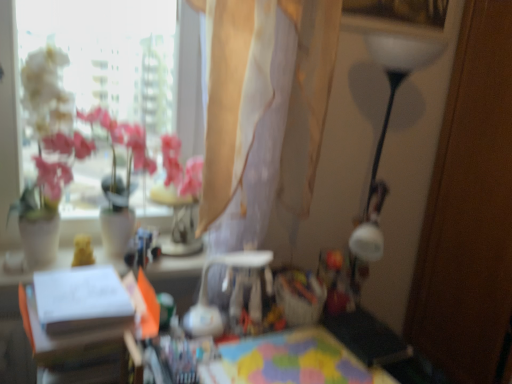
Question: Is white paper at center, the first table viewed from the left, a part of translucent beige curtain at upper center?

Choices:
 (A) yes
 (B) no

Answer: (B)

Question: Does translucent beige curtain at upper center have a smaller size compared to white paper at center, the first table viewed from the left?

Choices:
 (A) yes
 (B) no

Answer: (B)

Question: Does translucent beige curtain at upper center appear on the right side of white paper at center, which is the second table in right-to-left order?

Choices:
 (A) no
 (B) yes

Answer: (B)

Question: Is translucent beige curtain at upper center outside of white paper at center, the first table viewed from the left?

Choices:
 (A) no
 (B) yes

Answer: (B)

Question: Considering the relative sizes of translucent beige curtain at upper center and white paper at center, which is the second table in right-to-left order, in the image provided, is translucent beige curtain at upper center taller than white paper at center, which is the second table in right-to-left order,?

Choices:
 (A) no
 (B) yes

Answer: (B)

Question: From a real-world perspective, is multicolored fabric at center, the 2th table positioned from the left, physically located above or below white paper at center, which is the second table in right-to-left order?

Choices:
 (A) above
 (B) below

Answer: (B)

Question: In the image, is multicolored fabric at center, the 2th table positioned from the left, on the left side or the right side of white paper at center, the first table viewed from the left?

Choices:
 (A) left
 (B) right

Answer: (B)

Question: From the image's perspective, is multicolored fabric at center, acting as the 1th table starting from the right, above or below white paper at center, the first table viewed from the left?

Choices:
 (A) above
 (B) below

Answer: (B)

Question: Is multicolored fabric at center, the 2th table positioned from the left, in front of or behind white paper at center, which is the second table in right-to-left order, in the image?

Choices:
 (A) behind
 (B) front

Answer: (A)

Question: From the image's perspective, is translucent beige curtain at upper center located above or below white paper at center, which is the second table in right-to-left order?

Choices:
 (A) below
 (B) above

Answer: (B)

Question: Is translucent beige curtain at upper center wider or thinner than white paper at center, which is the second table in right-to-left order?

Choices:
 (A) thin
 (B) wide

Answer: (A)

Question: From their relative heights in the image, would you say translucent beige curtain at upper center is taller or shorter than white paper at center, the first table viewed from the left?

Choices:
 (A) short
 (B) tall

Answer: (B)

Question: Considering their positions, is translucent beige curtain at upper center located in front of or behind white paper at center, the first table viewed from the left?

Choices:
 (A) front
 (B) behind

Answer: (B)

Question: Considering the positions of white paper at center, the first table viewed from the left, and multicolored fabric at center, acting as the 1th table starting from the right, in the image, is white paper at center, the first table viewed from the left, taller or shorter than multicolored fabric at center, acting as the 1th table starting from the right,?

Choices:
 (A) tall
 (B) short

Answer: (A)

Question: From a real-world perspective, is white paper at center, the first table viewed from the left, above or below multicolored fabric at center, the 2th table positioned from the left?

Choices:
 (A) above
 (B) below

Answer: (A)